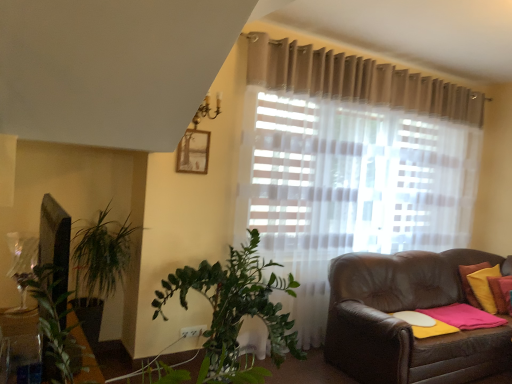
Question: Would you say yellow fabric pillow at right, which is counted as the 2th pillow, starting from the right, is outside yellow fabric pillow at right, which appears as the second pillow when viewed from the left?

Choices:
 (A) no
 (B) yes

Answer: (A)

Question: Does yellow fabric pillow at right, which ranks as the first pillow in left-to-right order, have a greater height compared to yellow fabric pillow at right, which appears as the second pillow when viewed from the left?

Choices:
 (A) yes
 (B) no

Answer: (B)

Question: Considering the relative sizes of yellow fabric pillow at right, which ranks as the first pillow in left-to-right order, and yellow fabric pillow at right, acting as the 1th pillow starting from the right, in the image provided, is yellow fabric pillow at right, which ranks as the first pillow in left-to-right order, thinner than yellow fabric pillow at right, acting as the 1th pillow starting from the right,?

Choices:
 (A) yes
 (B) no

Answer: (A)

Question: From the image's perspective, is yellow fabric pillow at right, which is counted as the 2th pillow, starting from the right, below yellow fabric pillow at right, acting as the 1th pillow starting from the right?

Choices:
 (A) yes
 (B) no

Answer: (B)

Question: From the image's perspective, is yellow fabric pillow at right, which ranks as the first pillow in left-to-right order, on top of yellow fabric pillow at right, acting as the 1th pillow starting from the right?

Choices:
 (A) yes
 (B) no

Answer: (A)

Question: In terms of size, does matte wooden picture frame at upper center appear bigger or smaller than yellow fabric pillow at right, acting as the 1th pillow starting from the right?

Choices:
 (A) small
 (B) big

Answer: (A)

Question: From a real-world perspective, is matte wooden picture frame at upper center physically located above or below yellow fabric pillow at right, which appears as the second pillow when viewed from the left?

Choices:
 (A) above
 (B) below

Answer: (A)

Question: From the image's perspective, is matte wooden picture frame at upper center positioned above or below yellow fabric pillow at right, acting as the 1th pillow starting from the right?

Choices:
 (A) below
 (B) above

Answer: (B)

Question: Is matte wooden picture frame at upper center wider or thinner than yellow fabric pillow at right, which appears as the second pillow when viewed from the left?

Choices:
 (A) thin
 (B) wide

Answer: (A)

Question: From a real-world perspective, is yellow fabric pillow at right, which ranks as the first pillow in left-to-right order, positioned above or below yellow fabric pillow at right, which appears as the second pillow when viewed from the left?

Choices:
 (A) below
 (B) above

Answer: (B)

Question: Is yellow fabric pillow at right, which ranks as the first pillow in left-to-right order, taller or shorter than yellow fabric pillow at right, which appears as the second pillow when viewed from the left?

Choices:
 (A) short
 (B) tall

Answer: (A)

Question: Considering the positions of yellow fabric pillow at right, which ranks as the first pillow in left-to-right order, and yellow fabric pillow at right, acting as the 1th pillow starting from the right, in the image, is yellow fabric pillow at right, which ranks as the first pillow in left-to-right order, bigger or smaller than yellow fabric pillow at right, acting as the 1th pillow starting from the right,?

Choices:
 (A) small
 (B) big

Answer: (A)

Question: Is yellow fabric pillow at right, which ranks as the first pillow in left-to-right order, to the left or to the right of yellow fabric pillow at right, which appears as the second pillow when viewed from the left, in the image?

Choices:
 (A) left
 (B) right

Answer: (A)

Question: Does point (473, 292) appear closer or farther from the camera than point (187, 150)?

Choices:
 (A) farther
 (B) closer

Answer: (A)

Question: In the image, is yellow fabric pillow at right, which appears as the second pillow when viewed from the left, positioned in front of or behind matte wooden picture frame at upper center?

Choices:
 (A) behind
 (B) front

Answer: (A)